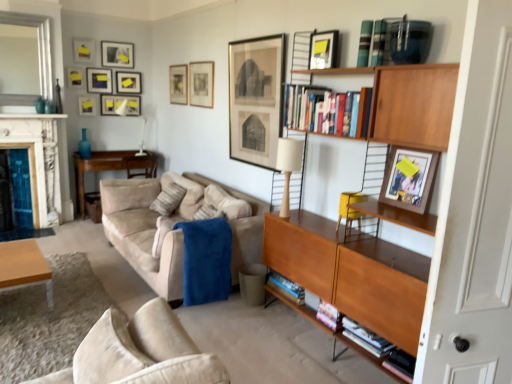
Question: Visually, is matte black picture frame at upper center, which appears as the twelfth picture frame when viewed from the front, positioned to the left or to the right of marble fireplace at left?

Choices:
 (A) right
 (B) left

Answer: (A)

Question: Relative to marble fireplace at left, is matte black picture frame at upper center, the seventh picture frame from the left, in front or behind?

Choices:
 (A) front
 (B) behind

Answer: (B)

Question: Which object is positioned closest to the hardcover books at upper center, acting as the 1th book starting from the left?

Choices:
 (A) transparent glass door at right
 (B) matte black picture frame at upper left, which ranks as the fourth picture frame in left-to-right order
 (C) marble fireplace at left
 (D) matte yellow picture frame at upper left, positioned as the third picture frame in left-to-right order
 (E) textured beige pillow at center

Answer: (A)

Question: Estimate the real-world distances between objects in this image. Which object is farther from the matte yellow picture frame at upper left, marked as the sixth picture frame in a back-to-front arrangement?

Choices:
 (A) matte black picture frame at upper left, placed as the 5th picture frame when sorted from left to right
 (B) yellow fabric armchair at right
 (C) plaid fabric book at upper center, the 1th book when ordered from right to left
 (D) wooden picture frame at upper right, the 12th picture frame from the back
 (E) matte black picture frame at upper center, placed as the 2th picture frame when sorted from right to left

Answer: (D)